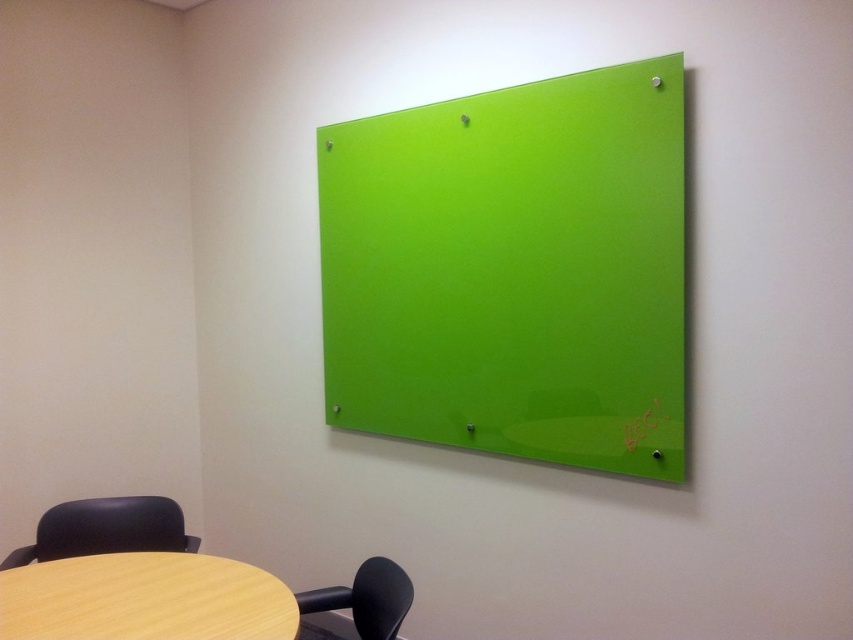
You are trying to place a laptop on the wooden table at lower left and the black leather swivel chair at lower left. Which surface is more suitable for placing the laptop?

The wooden table at lower left is more suitable for placing the laptop because it is a flat surface, while the black leather swivel chair at lower left is taller and not designed for placing items on top.

You are sitting in the matte black chair at lower left and want to reach the wooden table at lower left. Which direction should you move to get closer to the table?

Since the wooden table at lower left is positioned on the left side of the matte black chair at lower left, you should move to your left to get closer to the table.

You are organizing a small meeting in the room and need to seat two people. You have the black leather swivel chair at lower left and the matte black chair at lower left. Which chair should you choose if you want a larger seating area?

The black leather swivel chair at lower left is bigger than the matte black chair at lower left, so you should choose the black leather swivel chair at lower left for a larger seating area.